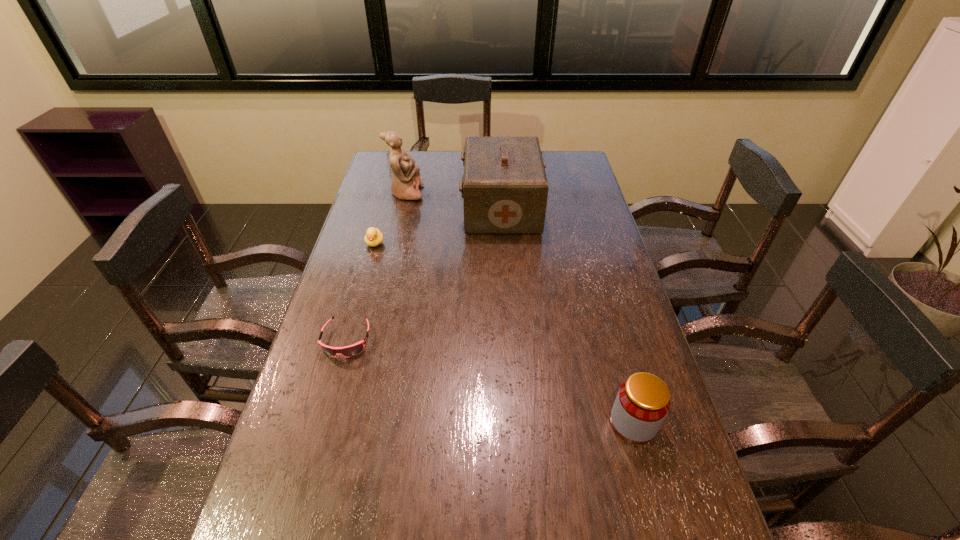
At what (x,y) coordinates should I click in order to perform the action: click on figurine. Please return your answer as a coordinate pair (x, y). Looking at the image, I should click on [x=405, y=184].

At what (x,y) coordinates should I click in order to perform the action: click on the fourth object from left to right. Please return your answer as a coordinate pair (x, y). Image resolution: width=960 pixels, height=540 pixels. Looking at the image, I should click on (504, 187).

Image resolution: width=960 pixels, height=540 pixels. What are the coordinates of `the rightmost object` in the screenshot? It's located at (643, 400).

Where is `jar`? The width and height of the screenshot is (960, 540). jar is located at coordinates (643, 400).

Locate an element on the screen. The width and height of the screenshot is (960, 540). the fourth tallest object is located at coordinates (373, 237).

This screenshot has height=540, width=960. I want to click on goggles, so click(348, 351).

You are a GUI agent. You are given a task and a screenshot of the screen. Output one action in this format:
    pyautogui.click(x=<x>, y=<y>)
    Task: Click on the second nearest object
    The height and width of the screenshot is (540, 960).
    Given the screenshot: What is the action you would take?
    pyautogui.click(x=348, y=351)

Where is `vacant space located 0.380m on the front-facing side of the figurine`? vacant space located 0.380m on the front-facing side of the figurine is located at coordinates (519, 193).

The height and width of the screenshot is (540, 960). Find the location of `free space located 0.180m on the right of the fourth object from left to right`. free space located 0.180m on the right of the fourth object from left to right is located at coordinates (588, 208).

This screenshot has width=960, height=540. I want to click on blank area located 0.120m on the left of the jar, so click(x=559, y=423).